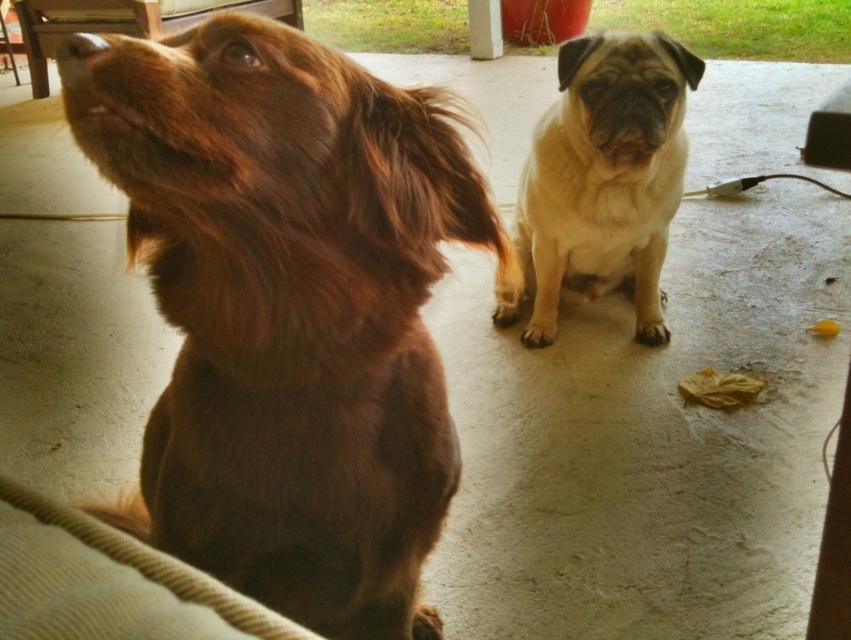
You are a photographer taking a picture of the brown furry dog at left and the beige fur dog at center. Which dog will appear larger in the photo?

The brown furry dog at left will appear larger in the photo because it is closer to the viewer than the beige fur dog at center.

You are standing in front of the two dogs on the porch. You notice two points marked on the ground. The first point is at coordinates point (x=116, y=168) and the second is at point (x=623, y=147). Which point is closer to you?

Point (x=116, y=168) is closer to the viewer than point (x=623, y=147).

You are a dog trainer observing two dogs in a training session. The dogs are the brown furry dog at left and the beige fur dog at center. Which dog would require a larger training mat to accommodate its size?

The brown furry dog at left requires a larger training mat because it has a larger size compared to the beige fur dog at center.